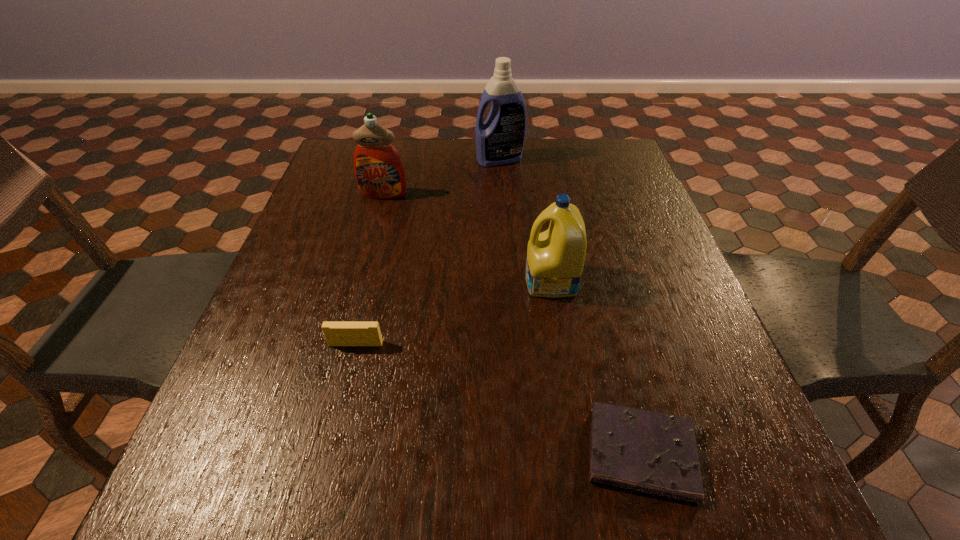
At what (x,y) coordinates should I click in order to perform the action: click on object located in the right edge section of the desktop. Please return your answer as a coordinate pair (x, y). The height and width of the screenshot is (540, 960). Looking at the image, I should click on (656, 453).

The image size is (960, 540). Identify the location of object present at the near right corner. (656, 453).

This screenshot has height=540, width=960. I want to click on free space at the far edge, so click(x=409, y=140).

Identify the location of vacant space at the near edge of the desktop. The image size is (960, 540). (549, 469).

In order to click on free space at the left edge of the desktop in this screenshot , I will do `click(312, 226)`.

Locate an element on the screen. This screenshot has width=960, height=540. blank space at the right edge of the desktop is located at coordinates (600, 212).

The height and width of the screenshot is (540, 960). I want to click on free space at the far left corner of the desktop, so click(339, 153).

Locate an element on the screen. The image size is (960, 540). free space at the far right corner is located at coordinates (625, 152).

Where is `vacant space that's between the nearest detergent and the second nearest detergent`? Image resolution: width=960 pixels, height=540 pixels. vacant space that's between the nearest detergent and the second nearest detergent is located at coordinates (468, 238).

Find the location of `free space between the third farthest object and the farthest object`. free space between the third farthest object and the farthest object is located at coordinates (525, 220).